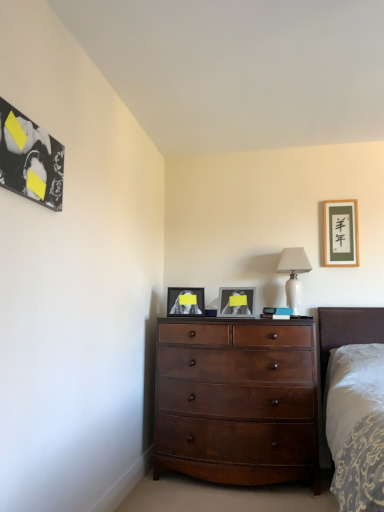
Question: Can you confirm if matte gold picture frame at upper right, which appears as the fourth picture frame when viewed from the front, is bigger than black glossy picture frame at upper left, positioned as the fourth picture frame in right-to-left order?

Choices:
 (A) yes
 (B) no

Answer: (A)

Question: Is matte gold picture frame at upper right, the 1th picture frame when ordered from back to front, oriented towards black glossy picture frame at upper left, acting as the first picture frame starting from the left?

Choices:
 (A) yes
 (B) no

Answer: (B)

Question: Can you confirm if matte gold picture frame at upper right, the 1th picture frame when ordered from back to front, is positioned to the left of black glossy picture frame at upper left, acting as the first picture frame starting from the left?

Choices:
 (A) no
 (B) yes

Answer: (A)

Question: Is matte gold picture frame at upper right, the 1th picture frame when ordered from back to front, taller than black glossy picture frame at upper left, acting as the first picture frame starting from the left?

Choices:
 (A) yes
 (B) no

Answer: (A)

Question: Is black glossy picture frame at upper left, acting as the 1th picture frame starting from the front, surrounded by matte gold picture frame at upper right, the 1th picture frame when ordered from back to front?

Choices:
 (A) no
 (B) yes

Answer: (A)

Question: From their relative heights in the image, would you say white glossy picture frame at center, the 3th picture frame positioned from the back, is taller or shorter than black glossy picture frame at upper left, acting as the first picture frame starting from the left?

Choices:
 (A) tall
 (B) short

Answer: (A)

Question: Is white glossy picture frame at center, the 3th picture frame positioned from the back, inside or outside of black glossy picture frame at upper left, acting as the first picture frame starting from the left?

Choices:
 (A) outside
 (B) inside

Answer: (A)

Question: Considering their positions, is white glossy picture frame at center, the 3th picture frame positioned from the back, located in front of or behind black glossy picture frame at upper left, acting as the 1th picture frame starting from the front?

Choices:
 (A) behind
 (B) front

Answer: (A)

Question: Based on their sizes in the image, would you say white glossy picture frame at center, the 3th picture frame positioned from the back, is bigger or smaller than black glossy picture frame at upper left, acting as the first picture frame starting from the left?

Choices:
 (A) big
 (B) small

Answer: (A)

Question: Is matte black picture frame at center, the third picture frame positioned from the front, wider or thinner than mahogany wood dresser at center?

Choices:
 (A) thin
 (B) wide

Answer: (A)

Question: From the image's perspective, is matte black picture frame at center, arranged as the 2th picture frame when viewed from the back, located above or below mahogany wood dresser at center?

Choices:
 (A) below
 (B) above

Answer: (B)

Question: Is point (192, 304) closer or farther from the camera than point (243, 441)?

Choices:
 (A) farther
 (B) closer

Answer: (A)

Question: Considering their positions, is matte black picture frame at center, which is the second picture frame from left to right, located in front of or behind mahogany wood dresser at center?

Choices:
 (A) front
 (B) behind

Answer: (B)

Question: Considering the positions of matte gold picture frame at upper right, positioned as the first picture frame in right-to-left order, and white glossy table lamp at upper right in the image, is matte gold picture frame at upper right, positioned as the first picture frame in right-to-left order, wider or thinner than white glossy table lamp at upper right?

Choices:
 (A) wide
 (B) thin

Answer: (B)

Question: From the image's perspective, relative to white glossy table lamp at upper right, is matte gold picture frame at upper right, which appears as the fourth picture frame when viewed from the front, above or below?

Choices:
 (A) below
 (B) above

Answer: (B)